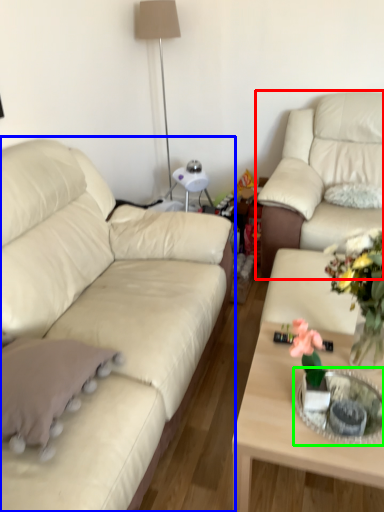
Question: Which object is the farthest from studio couch (highlighted by a red box)? Choose among these: studio couch (highlighted by a blue box) or glass table (highlighted by a green box).

Choices:
 (A) studio couch
 (B) glass table

Answer: (B)